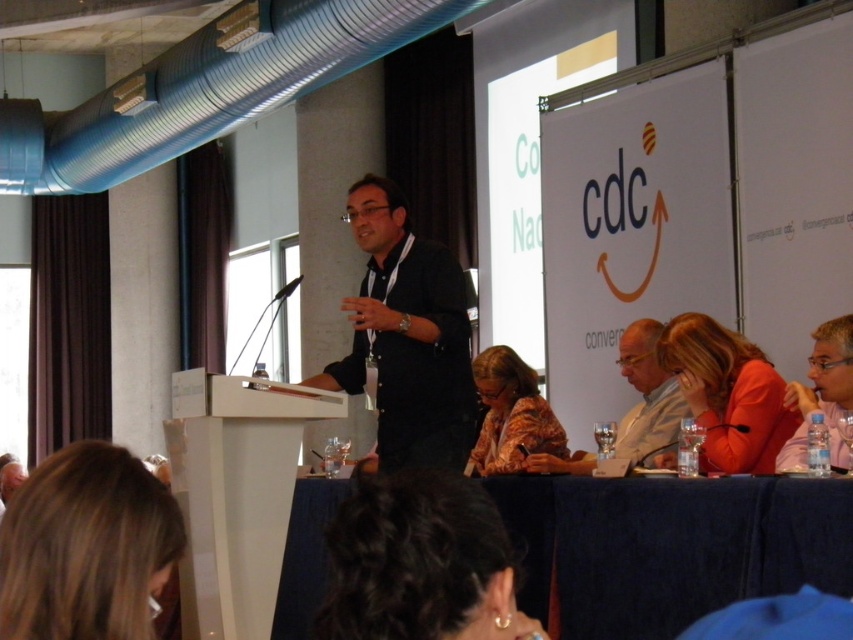
Question: Which object is positioned farthest from the blue fabric table at lower center?

Choices:
 (A) matte black shirt at center
 (B) matte black laptop at right
 (C) orange fabric jacket at lower right

Answer: (B)

Question: Which object appears farthest from the camera in this image?

Choices:
 (A) matte black shirt at center
 (B) dark curly hair at lower center
 (C) matte black laptop at right

Answer: (A)

Question: Can you confirm if blue fabric table at lower center is smaller than dark curly hair at lower center?

Choices:
 (A) no
 (B) yes

Answer: (B)

Question: Which point is farther to the camera?

Choices:
 (A) dark curly hair at lower center
 (B) matte black shirt at center

Answer: (B)

Question: Does orange fabric jacket at lower right appear on the left side of matte black shirt at center?

Choices:
 (A) no
 (B) yes

Answer: (A)

Question: Does blue fabric table at lower center come behind floral fabric jacket at lower center?

Choices:
 (A) no
 (B) yes

Answer: (B)